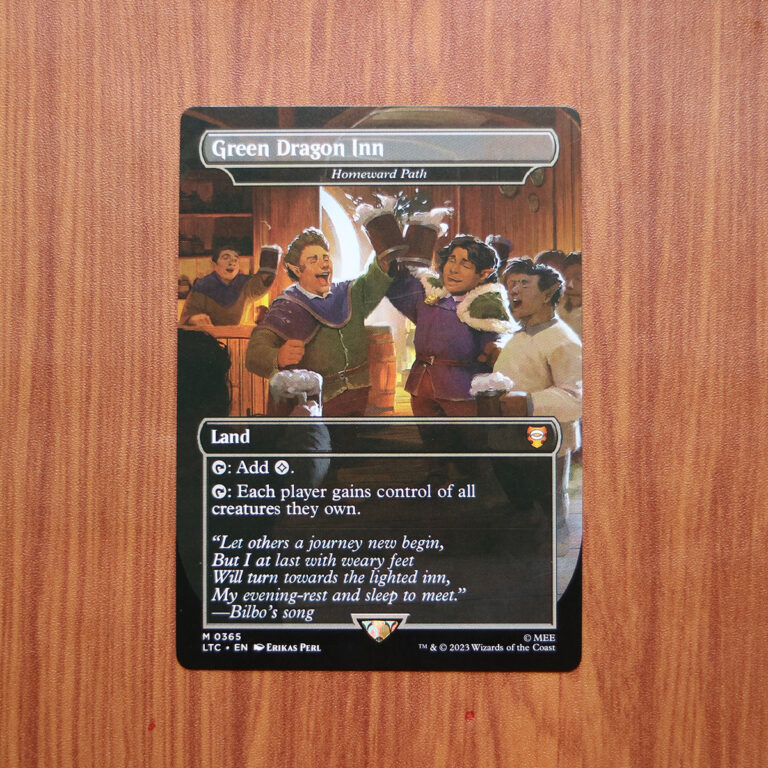
The width and height of the screenshot is (768, 768). In order to click on table in this screenshot , I will do `click(51, 435)`.